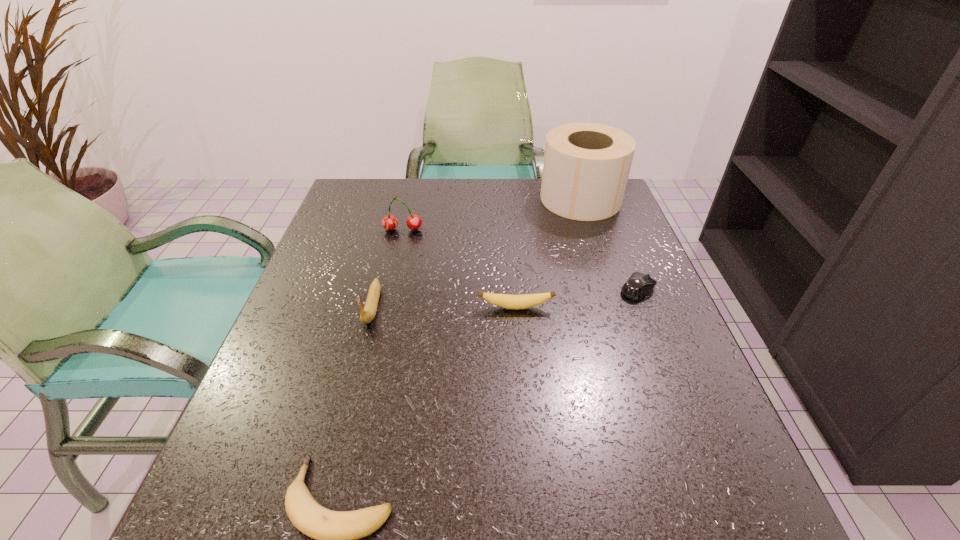
The image size is (960, 540). In the image, there is a desktop. Find the location of `vacant space at the left edge`. vacant space at the left edge is located at coordinates (372, 232).

Find the location of a particular element. The height and width of the screenshot is (540, 960). vacant area at the right edge is located at coordinates (663, 458).

The image size is (960, 540). In the image, there is a desktop. In order to click on blank space at the far left corner in this screenshot , I will do `click(370, 179)`.

Locate an element on the screen. The height and width of the screenshot is (540, 960). free location at the near left corner is located at coordinates (206, 531).

Find the location of a particular element. The width and height of the screenshot is (960, 540). vacant space at the far right corner of the desktop is located at coordinates (580, 220).

Locate an element on the screen. Image resolution: width=960 pixels, height=540 pixels. vacant space at the near right corner of the desktop is located at coordinates (765, 520).

Find the location of a particular element. free space that is in between the mouse and the rightmost banana is located at coordinates (577, 299).

At what (x,y) coordinates should I click in order to perform the action: click on empty location between the rightmost banana and the fourth shortest object. Please return your answer as a coordinate pair (x, y). This screenshot has height=540, width=960. Looking at the image, I should click on (444, 307).

The image size is (960, 540). What are the coordinates of `free area in between the tallest object and the third tallest object` in the screenshot? It's located at (477, 253).

Where is `vacant space that is in between the mouse and the second tallest banana`? The width and height of the screenshot is (960, 540). vacant space that is in between the mouse and the second tallest banana is located at coordinates (577, 299).